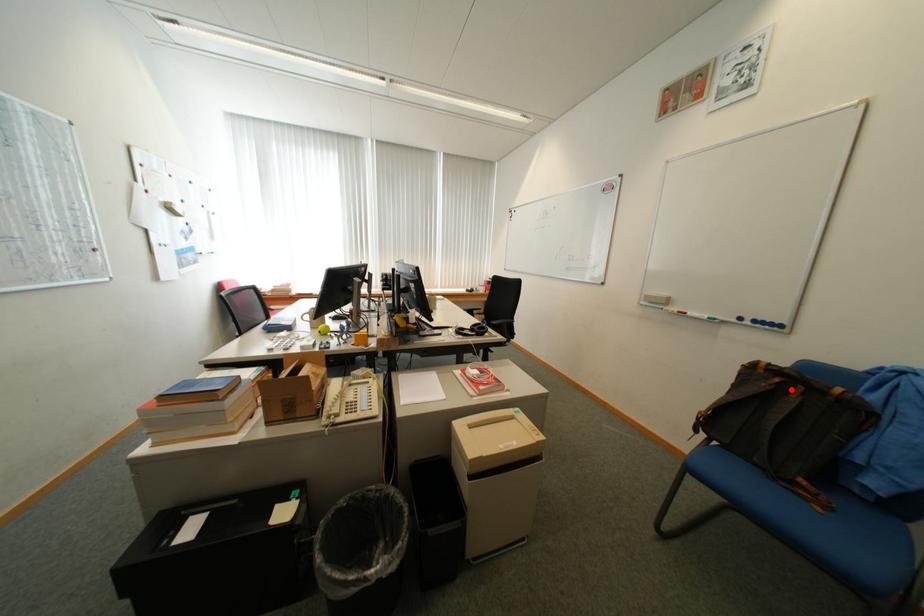
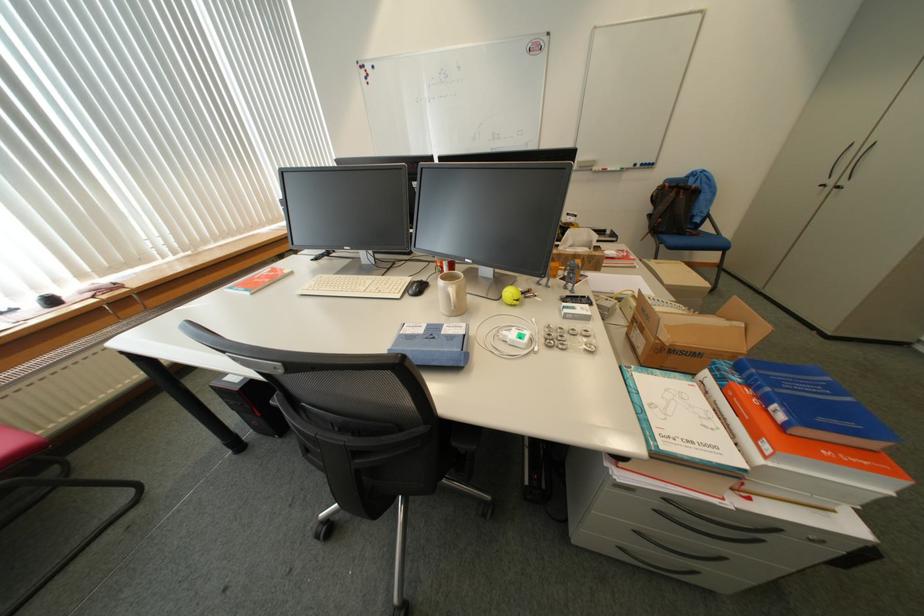
Question: I am providing you with two images of the same scene from different viewpoints. Image1 has a red point marked. In image2, the corresponding 3D location appears at what relative position? Reply with the corresponding letter.

Choices:
 (A) Closer
 (B) Farther

Answer: (A)